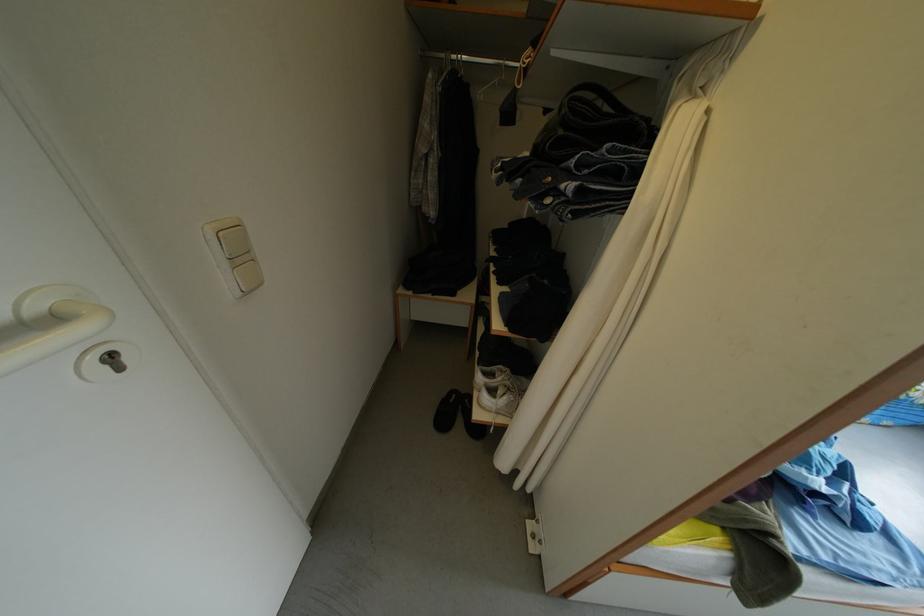
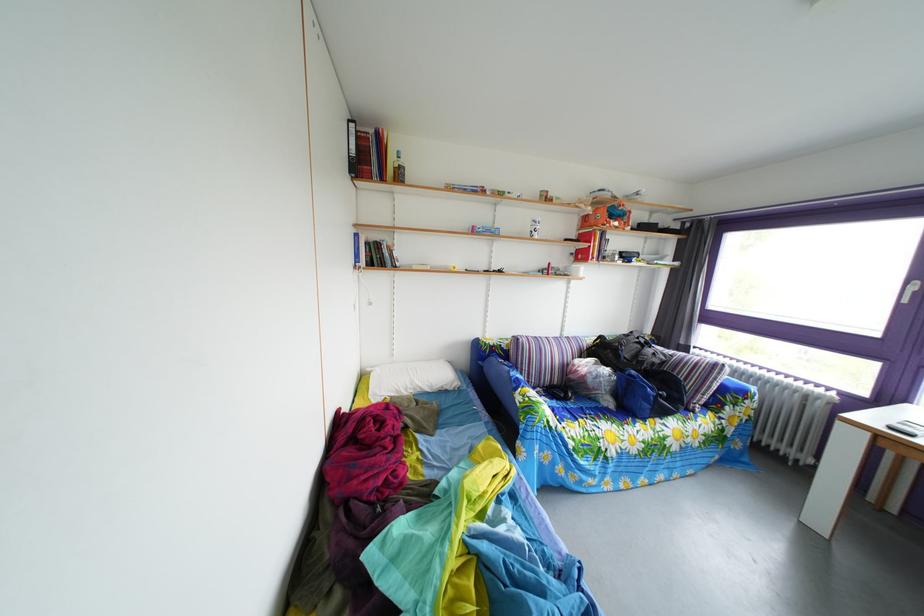
Question: Which direction would the cameraman need to move to produce the second image? Reply with the corresponding letter.

Choices:
 (A) Left
 (B) Right
 (C) Forward
 (D) Backward

Answer: (B)